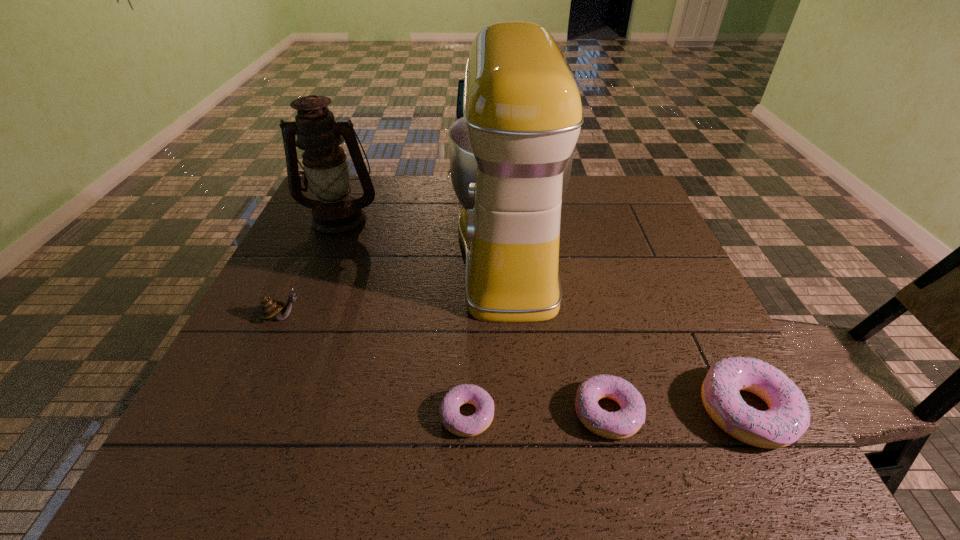
Identify the location of snail present at the left edge. The image size is (960, 540). (270, 309).

Image resolution: width=960 pixels, height=540 pixels. I want to click on object located in the right edge section of the desktop, so click(788, 417).

Where is `object that is positioned at the far left corner`? The width and height of the screenshot is (960, 540). object that is positioned at the far left corner is located at coordinates pos(335,214).

Where is `object at the near right corner`? This screenshot has height=540, width=960. object at the near right corner is located at coordinates (788, 417).

Locate an element on the screen. vacant space at the far edge of the desktop is located at coordinates (592, 210).

In the image, there is a desktop. Identify the location of vacant space at the near edge. (553, 386).

In the image, there is a desktop. Identify the location of vacant region at the left edge. Image resolution: width=960 pixels, height=540 pixels. (324, 286).

Locate an element on the screen. This screenshot has width=960, height=540. free space at the right edge of the desktop is located at coordinates (618, 224).

Image resolution: width=960 pixels, height=540 pixels. What are the coordinates of `free space at the near left corner of the desktop` in the screenshot? It's located at (247, 392).

This screenshot has width=960, height=540. In the image, there is a desktop. In order to click on free region at the far right corner in this screenshot , I will do `click(619, 199)`.